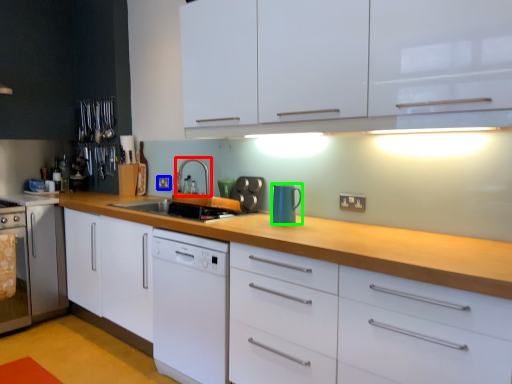
Question: Which is farther away from tap (highlighted by a red box)? electric outlet (highlighted by a blue box) or kitchen appliance (highlighted by a green box)?

Choices:
 (A) electric outlet
 (B) kitchen appliance

Answer: (B)